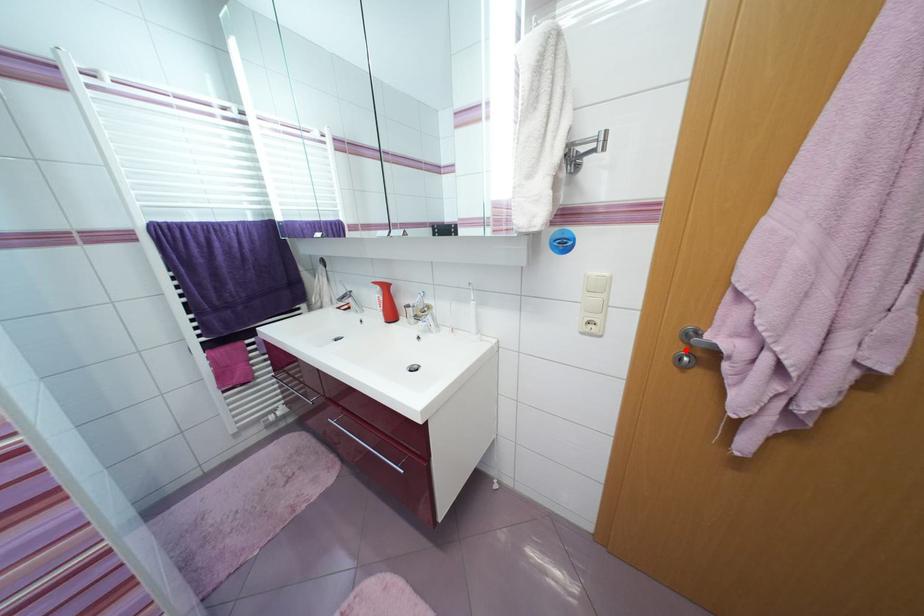
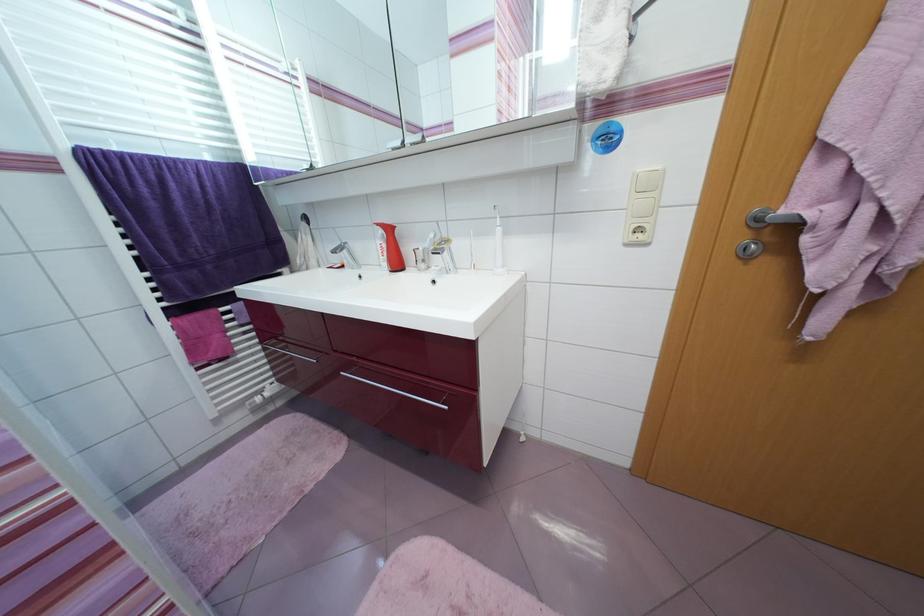
In the second image, find the point that corresponds to the highlighted location in the first image.

(748, 238)